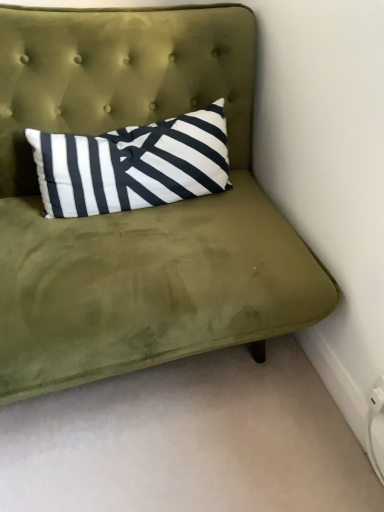
Where is `white plastic electric outlet at lower right`? white plastic electric outlet at lower right is located at coordinates (376, 396).

I want to click on velvet green headboard at upper center, so click(x=119, y=75).

Consider the image. Is velvet green headboard at upper center turned away from olive green velvet couch at upper center?

Yes, velvet green headboard at upper center's orientation is away from olive green velvet couch at upper center.

From the image's perspective, is velvet green headboard at upper center located above olive green velvet couch at upper center?

Yes, from the image's perspective, velvet green headboard at upper center is on top of olive green velvet couch at upper center.

Can you confirm if velvet green headboard at upper center is smaller than olive green velvet couch at upper center?

Yes, velvet green headboard at upper center is smaller than olive green velvet couch at upper center.

Are velvet green headboard at upper center and olive green velvet couch at upper center located far from each other?

They are positioned close to each other.

Visually, is olive green velvet couch at upper center positioned to the left or to the right of velvet green headboard at upper center?

From the image, it's evident that olive green velvet couch at upper center is to the left of velvet green headboard at upper center.

Is olive green velvet couch at upper center positioned in front of velvet green headboard at upper center?

That is True.

Looking at this image, is olive green velvet couch at upper center bigger than velvet green headboard at upper center?

Indeed, olive green velvet couch at upper center has a larger size compared to velvet green headboard at upper center.

Can you tell me how much olive green velvet couch at upper center and white plastic electric outlet at lower right differ in facing direction?

91 degrees separate the facing orientations of olive green velvet couch at upper center and white plastic electric outlet at lower right.

Which object is further away from the camera taking this photo, olive green velvet couch at upper center or white plastic electric outlet at lower right?

white plastic electric outlet at lower right is further from the camera.

From a real-world perspective, is olive green velvet couch at upper center on white plastic electric outlet at lower right?

Yes.

From their relative heights in the image, would you say olive green velvet couch at upper center is taller or shorter than white plastic electric outlet at lower right?

In the image, olive green velvet couch at upper center appears to be taller than white plastic electric outlet at lower right.

Is white plastic electric outlet at lower right directly adjacent to velvet green headboard at upper center?

No, white plastic electric outlet at lower right is not making contact with velvet green headboard at upper center.

Which point is more distant from viewer, (380, 389) or (45, 112)?

The point (45, 112) is farther from the camera.

How far apart are white plastic electric outlet at lower right and velvet green headboard at upper center?

white plastic electric outlet at lower right is 1.03 meters away from velvet green headboard at upper center.

Which object is closer to the camera taking this photo, white plastic electric outlet at lower right or velvet green headboard at upper center?

velvet green headboard at upper center.

Identify the location of studio couch to the left of white plastic electric outlet at lower right. Image resolution: width=384 pixels, height=512 pixels. (137, 210).

Which object is thinner, white plastic electric outlet at lower right or olive green velvet couch at upper center?

With smaller width is white plastic electric outlet at lower right.

Is white plastic electric outlet at lower right looking in the opposite direction of olive green velvet couch at upper center?

No, white plastic electric outlet at lower right is not facing the opposite direction of olive green velvet couch at upper center.

Can we say velvet green headboard at upper center lies outside white plastic electric outlet at lower right?

Yes.

At what (x,y) coordinates should I click in order to perform the action: click on headboard above the white plastic electric outlet at lower right (from the image's perspective). Please return your answer as a coordinate pair (x, y). Image resolution: width=384 pixels, height=512 pixels. Looking at the image, I should click on (119, 75).

Considering the positions of points (141, 123) and (375, 400), is point (141, 123) closer to camera compared to point (375, 400)?

That is False.

In the image, there is a velvet green headboard at upper center. Where is `studio couch below it (from the image's perspective)`? studio couch below it (from the image's perspective) is located at coordinates (137, 210).

Locate an element on the screen. headboard that appears behind the olive green velvet couch at upper center is located at coordinates point(119,75).

Looking at this image, based on their spatial positions, is olive green velvet couch at upper center or velvet green headboard at upper center further from white plastic electric outlet at lower right?

Based on the image, velvet green headboard at upper center appears to be further to white plastic electric outlet at lower right.

Estimate the real-world distances between objects in this image. Which object is further from olive green velvet couch at upper center, white plastic electric outlet at lower right or velvet green headboard at upper center?

white plastic electric outlet at lower right lies further to olive green velvet couch at upper center than the other object.

From the picture: Considering their positions, is olive green velvet couch at upper center positioned closer to velvet green headboard at upper center than white plastic electric outlet at lower right?

olive green velvet couch at upper center is closer to velvet green headboard at upper center.

Estimate the real-world distances between objects in this image. Which object is further from olive green velvet couch at upper center, velvet green headboard at upper center or white plastic electric outlet at lower right?

white plastic electric outlet at lower right is positioned further to the anchor olive green velvet couch at upper center.

From the image, which object appears to be farther from velvet green headboard at upper center, white plastic electric outlet at lower right or olive green velvet couch at upper center?

Among the two, white plastic electric outlet at lower right is located further to velvet green headboard at upper center.

Based on their spatial positions, is velvet green headboard at upper center or olive green velvet couch at upper center closer to white plastic electric outlet at lower right?

Among the two, olive green velvet couch at upper center is located nearer to white plastic electric outlet at lower right.

This screenshot has width=384, height=512. I want to click on headboard located between olive green velvet couch at upper center and white plastic electric outlet at lower right in the left-right direction, so click(119, 75).